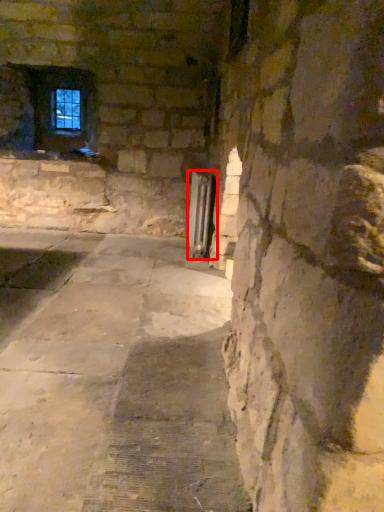
Question: From the image's perspective, where is elevator (annotated by the red box) located relative to window frame?

Choices:
 (A) above
 (B) below

Answer: (B)